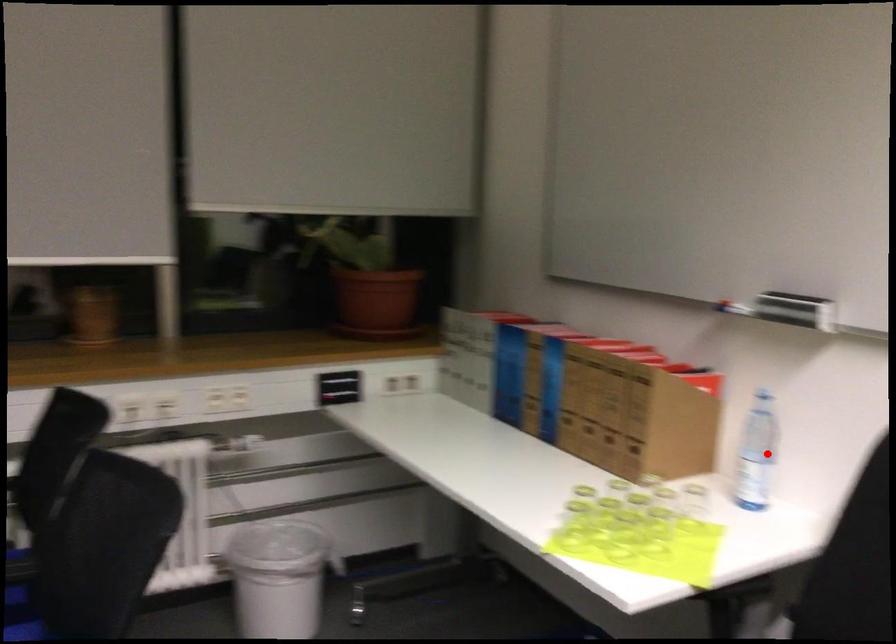
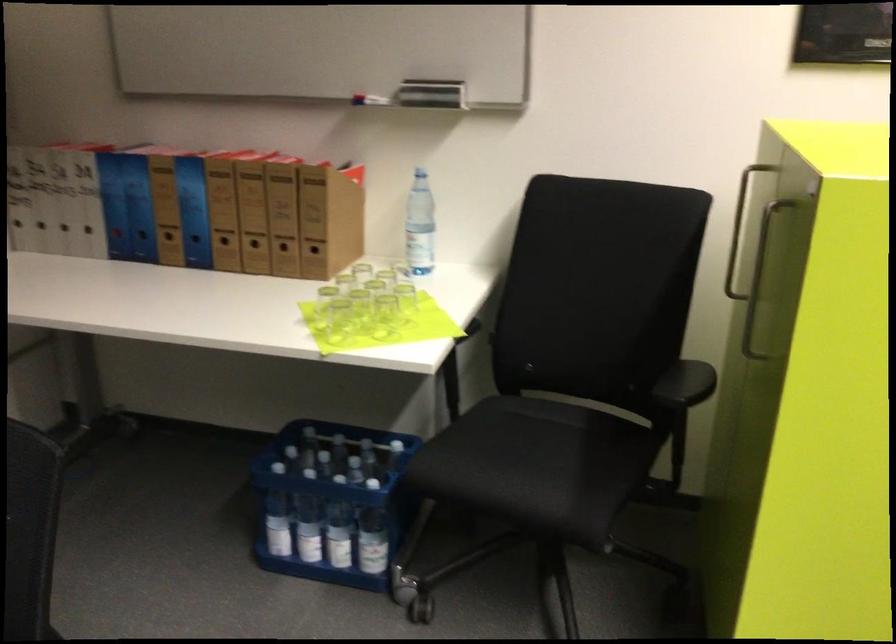
Locate, in the second image, the point that corresponds to the highlighted location in the first image.

(419, 225)